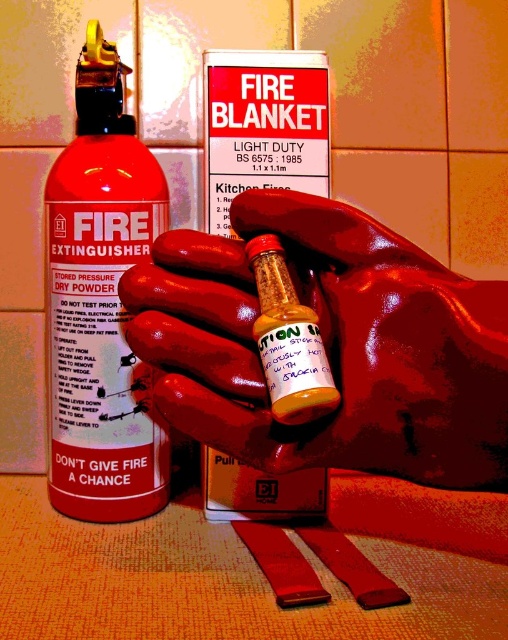
Locate an element on the screen. Image resolution: width=508 pixels, height=640 pixels. rubber glove at center is located at coordinates (329, 346).

Does rubber glove at center have a greater height compared to matte black fire extinguisher at left?

No.

Which is in front, point (491, 352) or point (111, 188)?

Point (491, 352)

Locate an element on the screen. rubber glove at center is located at coordinates (329, 346).

Is point (80, 74) closer to camera compared to point (279, 244)?

No.

Who is more distant from viewer, (109, 476) or (292, 324)?

The point (109, 476) is behind.

Between point (106, 152) and point (284, 340), which one is positioned in front?

Point (284, 340)

At what (x,y) coordinates should I click in order to perform the action: click on matte black fire extinguisher at left. Please return your answer as a coordinate pair (x, y). Looking at the image, I should click on (100, 301).

Can you confirm if rubber glove at center is taller than translucent plastic bottle at center?

Correct, rubber glove at center is much taller as translucent plastic bottle at center.

Does rubber glove at center have a smaller size compared to translucent plastic bottle at center?

Actually, rubber glove at center might be larger than translucent plastic bottle at center.

Describe the element at coordinates (329, 346) in the screenshot. The width and height of the screenshot is (508, 640). I see `rubber glove at center` at that location.

This screenshot has height=640, width=508. Identify the location of rubber glove at center. (329, 346).